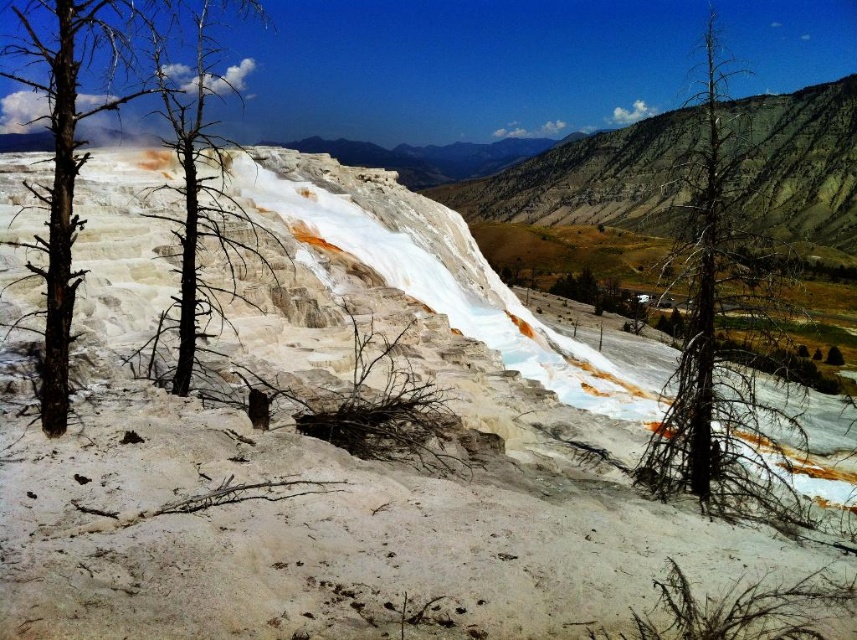
Question: Does dead wood tree at center have a smaller size compared to black dead tree at center?

Choices:
 (A) no
 (B) yes

Answer: (A)

Question: Which object is farther from the camera taking this photo?

Choices:
 (A) black dead tree at center
 (B) dead wood tree at center

Answer: (B)

Question: Is charred wood tree at left above black dead tree at center?

Choices:
 (A) no
 (B) yes

Answer: (A)

Question: Is dead wood tree at center closer to camera compared to charred wood tree at left?

Choices:
 (A) yes
 (B) no

Answer: (B)

Question: Which object appears closest to the camera in this image?

Choices:
 (A) charred wood tree at left
 (B) dead wood tree at center
 (C) black dead tree at center

Answer: (A)

Question: Which of the following is the farthest from the observer?

Choices:
 (A) (706, 35)
 (B) (255, 4)

Answer: (A)